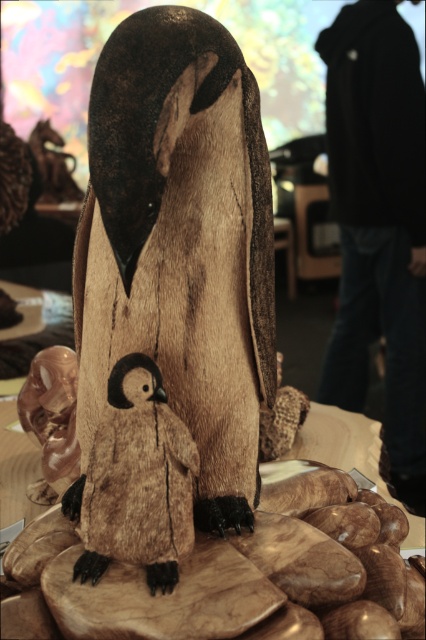
Question: Does wooden penguin at center have a lesser width compared to translucent amber penguin at lower left?

Choices:
 (A) no
 (B) yes

Answer: (A)

Question: Among these points, which one is nearest to the camera?

Choices:
 (A) coord(31,408)
 (B) coord(155,216)
 (C) coord(118,432)

Answer: (B)

Question: Which object is closer to the camera taking this photo?

Choices:
 (A) wooden penguin at center
 (B) brown fuzzy penguin at center
 (C) translucent amber penguin at lower left

Answer: (A)

Question: Is wooden penguin at center above brown fuzzy penguin at center?

Choices:
 (A) no
 (B) yes

Answer: (B)

Question: Among these objects, which one is nearest to the camera?

Choices:
 (A) translucent amber penguin at lower left
 (B) brown fuzzy penguin at center

Answer: (B)

Question: Does wooden penguin at center have a lesser width compared to brown fuzzy penguin at center?

Choices:
 (A) no
 (B) yes

Answer: (A)